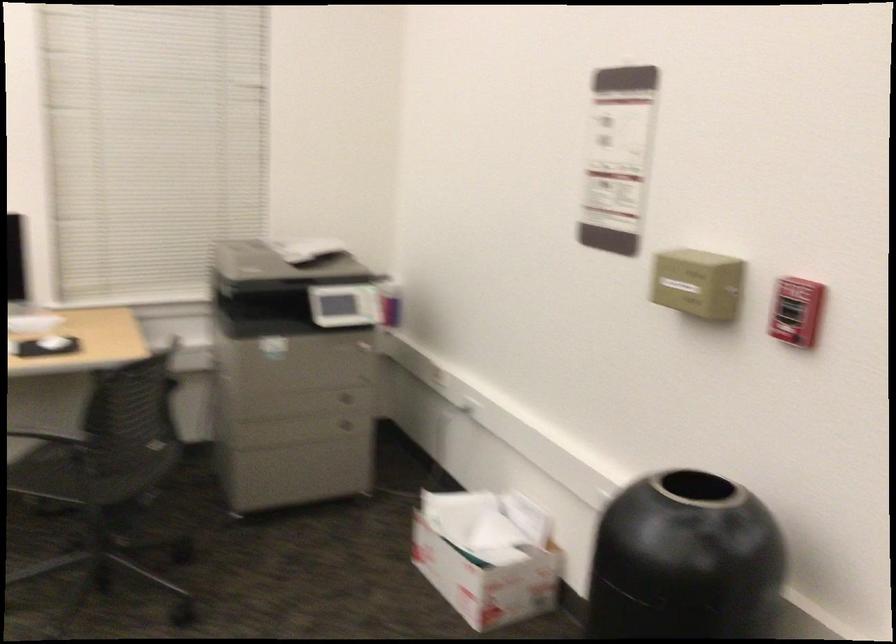
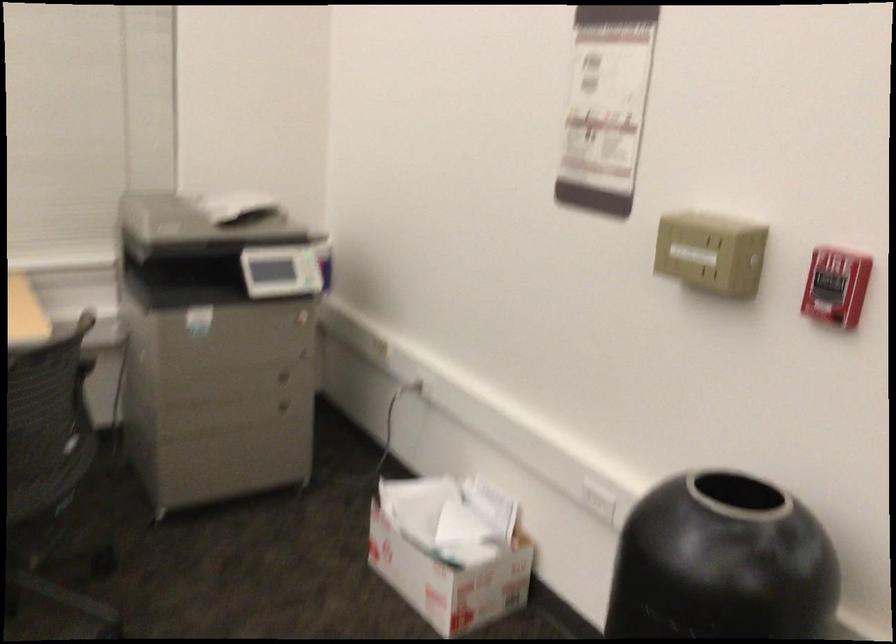
Question: The camera is either moving clockwise (left) or counter-clockwise (right) around the object. The first image is from the beginning of the video and the second image is from the end. Is the camera moving left or right when shooting the video?

Choices:
 (A) Left
 (B) Right

Answer: (A)